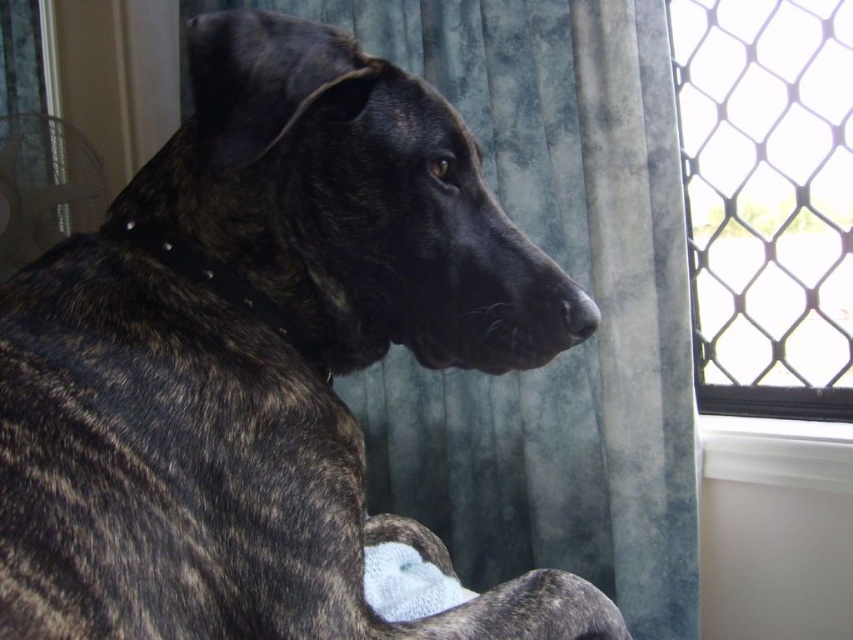
Question: Does black mesh screen at upper right appear on the right side of white plastic window sill at lower right?

Choices:
 (A) yes
 (B) no

Answer: (A)

Question: Among these points, which one is nearest to the camera?

Choices:
 (A) (x=793, y=99)
 (B) (x=334, y=609)
 (C) (x=704, y=467)

Answer: (B)

Question: Is brindle fur at center bigger than white plastic window sill at lower right?

Choices:
 (A) no
 (B) yes

Answer: (B)

Question: Among these points, which one is farthest from the camera?

Choices:
 (A) (706, 458)
 (B) (526, 364)

Answer: (A)

Question: Which point is farther to the camera?

Choices:
 (A) coord(838,428)
 (B) coord(326,170)

Answer: (A)

Question: Can you confirm if brindle fur at center is positioned to the left of white plastic window sill at lower right?

Choices:
 (A) yes
 (B) no

Answer: (A)